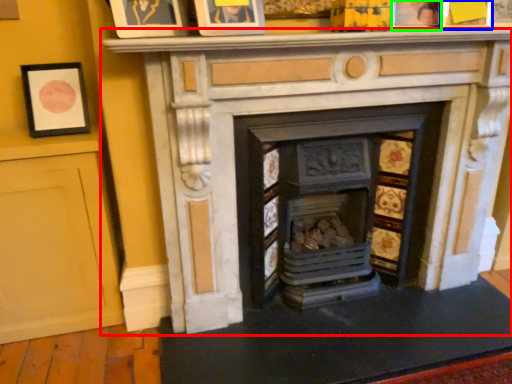
Question: Which is farther away from fireplace (highlighted by a red box)? picture frame (highlighted by a blue box) or picture frame (highlighted by a green box)?

Choices:
 (A) picture frame
 (B) picture frame

Answer: (A)